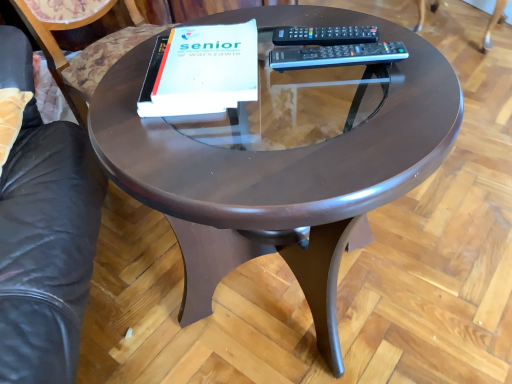
Locate an element on the screen. free space in front of black plastic remote at upper right, the first remote when ordered from front to back is located at coordinates (371, 138).